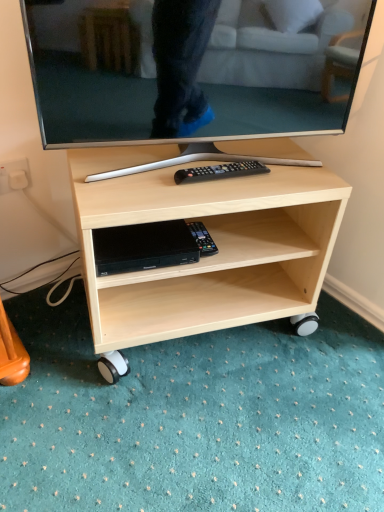
The width and height of the screenshot is (384, 512). I want to click on vacant area situated to the left side of black plastic remote at center, so click(x=143, y=175).